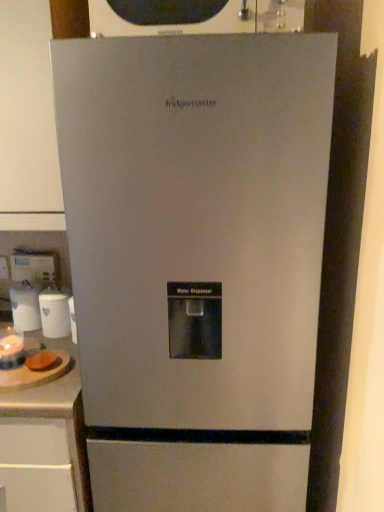
Question: From a real-world perspective, is satin silver refrigerator at center positioned above or below white glossy canister at left, acting as the second appliance starting from the back?

Choices:
 (A) below
 (B) above

Answer: (A)

Question: Considering the positions of point (180, 242) and point (46, 314), is point (180, 242) closer or farther from the camera than point (46, 314)?

Choices:
 (A) closer
 (B) farther

Answer: (A)

Question: Considering the real-world distances, which object is farthest from the white glossy canister at left, acting as the second appliance starting from the back?

Choices:
 (A) satin silver refrigerator at center
 (B) brown bread at left
 (C) matte glass candle at lower left, which appears as the third appliance when viewed from the back
 (D) white glossy water dispenser at center, acting as the 1th appliance starting from the back
 (E) wooden cutting board at lower left

Answer: (A)

Question: Which object is the farthest from the white glossy canister at left, marked as the 2th appliance in a front-to-back arrangement?

Choices:
 (A) satin silver refrigerator at center
 (B) wooden cutting board at lower left
 (C) brown bread at left
 (D) white glossy water dispenser at center, acting as the 1th appliance starting from the back
 (E) matte glass candle at lower left, which appears as the third appliance when viewed from the back

Answer: (A)